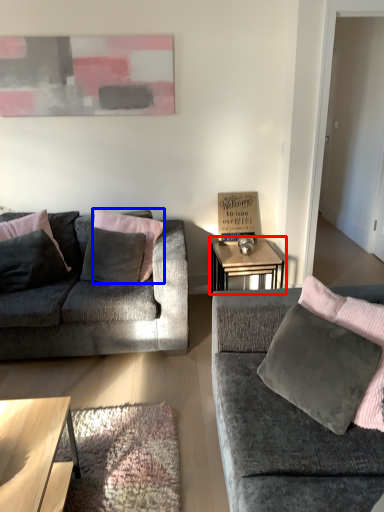
Question: Which object is further to the camera taking this photo, table (highlighted by a red box) or pillow (highlighted by a blue box)?

Choices:
 (A) table
 (B) pillow

Answer: (A)